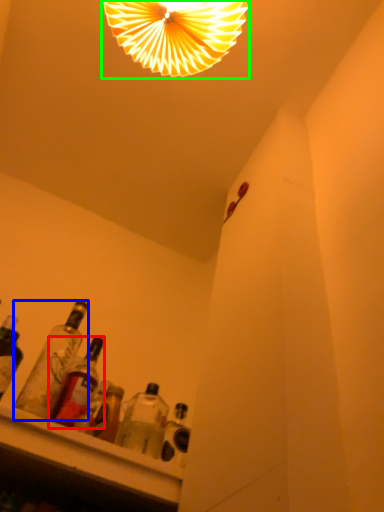
Question: Which object is positioned farthest from bottle (highlighted by a red box)? Select from bottle (highlighted by a blue box) and lamp (highlighted by a green box).

Choices:
 (A) bottle
 (B) lamp

Answer: (B)